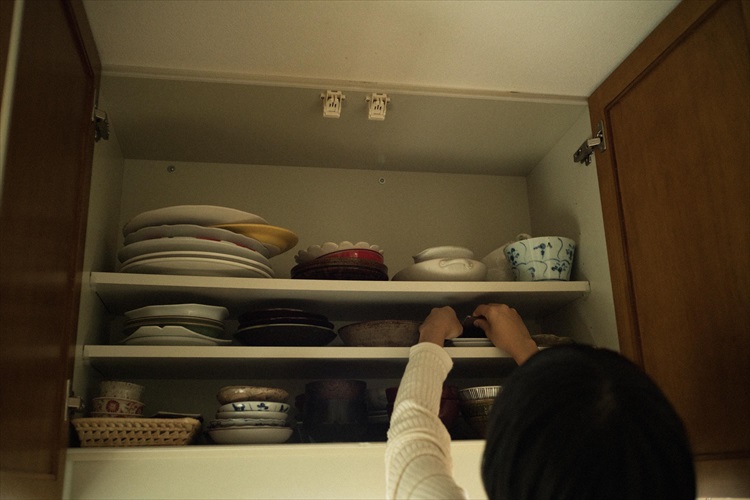
What are the coordinates of `cabinet doors` in the screenshot? It's located at (704, 128), (45, 182).